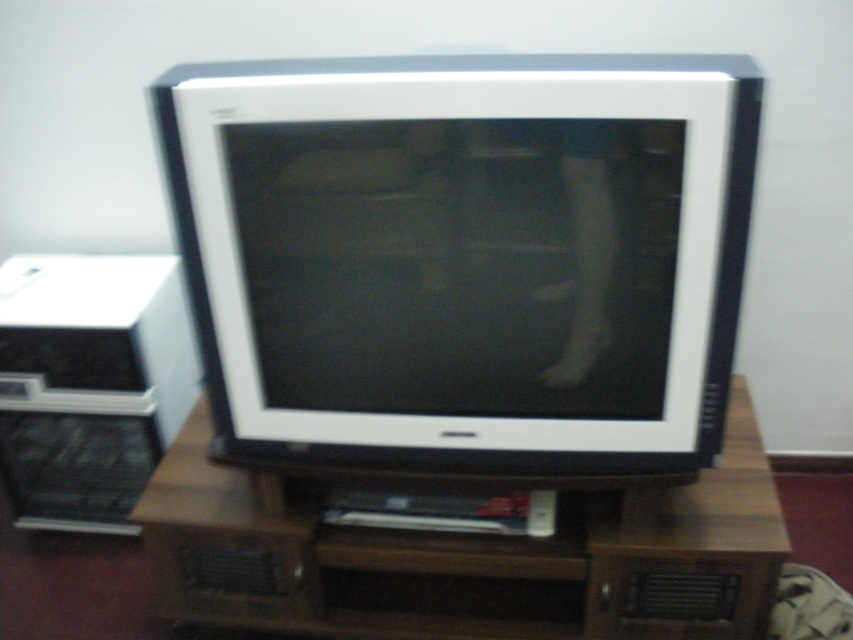
You are standing in front of the vintage CRT television setup. You need to reach the white plastic monitor at center and the brown wood entertainment center at center to adjust their settings. Which one will you need to step closer to first?

You will need to step closer to the white plastic monitor at center first because it is closer to you than the brown wood entertainment center at center, so you can adjust it without moving further forward.

You are standing in front of the vintage CRT television setup. There is a point marked at coordinates point (440, 280). Can you determine if this point is within arm reach from your current position?

The point (440, 280) is 1.22 meters away from the viewer, so yes, it is within arm reach since the average arm length is about 0.7 meters, and 1.22 meters is slightly beyond but still reachable for most people.